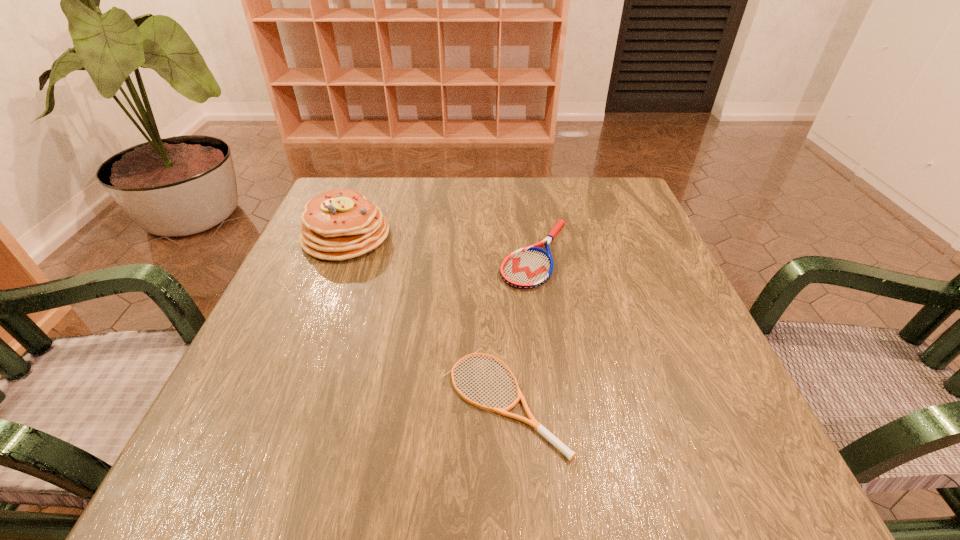
Identify the location of empty space that is in between the shorter tennis racket and the second shortest object. The image size is (960, 540). (519, 327).

This screenshot has width=960, height=540. What are the coordinates of `the second closest object to the nearer tennis racket` in the screenshot? It's located at (337, 225).

Where is `object that is the closest one to the pancake`? object that is the closest one to the pancake is located at coordinates (530, 267).

Where is `free spot that satisfies the following two spatial constraints: 1. on the back side of the nearest object; 2. on the right side of the taller tennis racket`? free spot that satisfies the following two spatial constraints: 1. on the back side of the nearest object; 2. on the right side of the taller tennis racket is located at coordinates (497, 254).

The width and height of the screenshot is (960, 540). Identify the location of vacant region that satisfies the following two spatial constraints: 1. on the front side of the tallest object; 2. on the right side of the farther tennis racket. (339, 254).

This screenshot has width=960, height=540. Identify the location of free location that satisfies the following two spatial constraints: 1. on the front side of the farther tennis racket; 2. on the right side of the leftmost object. (339, 254).

The image size is (960, 540). I want to click on free space that satisfies the following two spatial constraints: 1. on the front side of the farther tennis racket; 2. on the right side of the pancake, so click(x=339, y=254).

The height and width of the screenshot is (540, 960). In order to click on vacant space that satisfies the following two spatial constraints: 1. on the front side of the shortest object; 2. on the left side of the tallest object in this screenshot , I will do `click(282, 400)`.